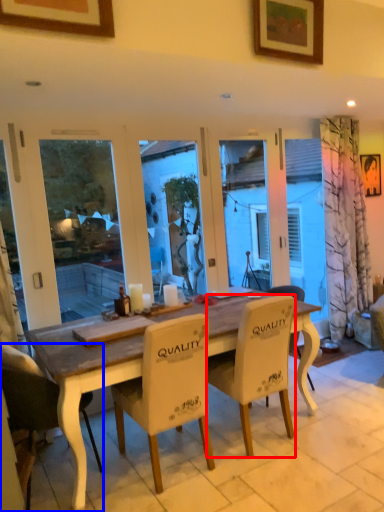
Question: Which of the following is the farthest to the observer, chair (highlighted by a red box) or chair (highlighted by a blue box)?

Choices:
 (A) chair
 (B) chair

Answer: (A)